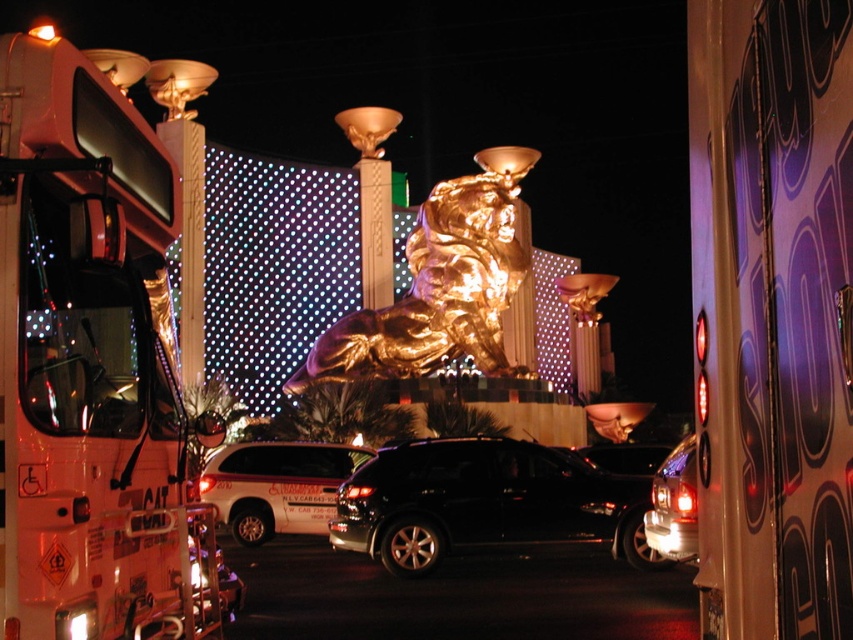
Question: Which point appears farthest from the camera in this image?

Choices:
 (A) (318, 461)
 (B) (71, 316)
 (C) (653, 492)
 (D) (401, 492)

Answer: (A)

Question: Which of the following is the farthest from the observer?

Choices:
 (A) white glossy suv at center
 (B) white glossy fire truck at left

Answer: (A)

Question: Is white glossy suv at center above glossy black car at lower right?

Choices:
 (A) no
 (B) yes

Answer: (A)

Question: Which object appears closest to the camera in this image?

Choices:
 (A) black metallic suv at center
 (B) white glossy fire truck at left

Answer: (B)

Question: Does white glossy fire truck at left appear on the left side of glossy black car at lower right?

Choices:
 (A) yes
 (B) no

Answer: (A)

Question: Can you confirm if white glossy fire truck at left is positioned to the right of black metallic suv at center?

Choices:
 (A) yes
 (B) no

Answer: (B)